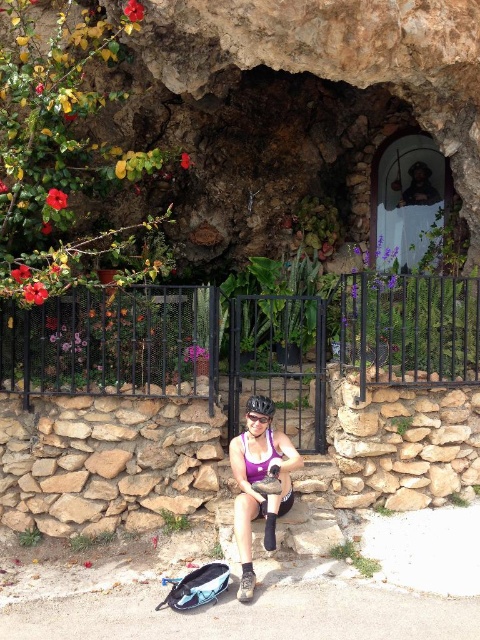
You are a fashion designer observing the scene. You need to determine which item of clothing or accessory is taller between the matte purple tank top at center and the transparent plastic goggles at center. Which one is taller?

The matte purple tank top at center is much taller than the transparent plastic goggles at center, so the matte purple tank top at center is taller.

From the picture: You are a cyclist who just finished a ride and wants to place both the black matte bicycle helmet at center and transparent plastic goggles at center on the stone ledge. Which item should you place first to ensure both fit properly?

The black matte bicycle helmet at center should be placed first on the right side of transparent plastic goggles at center to ensure both items fit properly on the stone ledge.